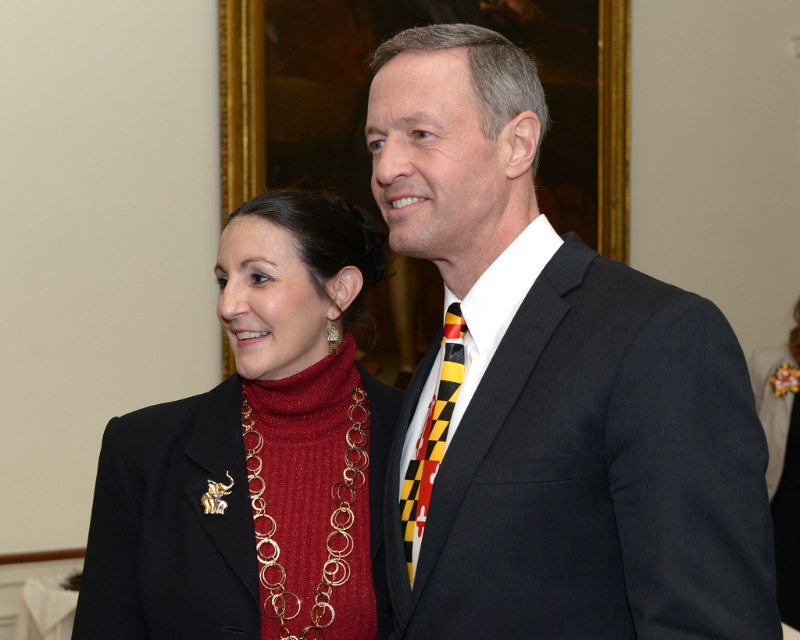
Who is lower down, black suit at center or velvet burgundy dress at right?

velvet burgundy dress at right is lower down.

Is black suit at center behind velvet burgundy dress at right?

No.

Between point (729, 481) and point (774, 355), which one is positioned behind?

The point (774, 355) is behind.

In order to click on black suit at center in this screenshot , I will do `click(554, 392)`.

Who is higher up, shiny gold necklace at center or velvet burgundy dress at right?

shiny gold necklace at center

Can you confirm if shiny gold necklace at center is positioned below velvet burgundy dress at right?

No.

Identify the location of shiny gold necklace at center. The image size is (800, 640). (245, 449).

Where is `shiny gold necklace at center`? shiny gold necklace at center is located at coordinates (245, 449).

This screenshot has height=640, width=800. Describe the element at coordinates (245, 449) in the screenshot. I see `shiny gold necklace at center` at that location.

Locate an element on the screen. Image resolution: width=800 pixels, height=640 pixels. shiny gold necklace at center is located at coordinates (245, 449).

Locate an element on the screen. shiny gold necklace at center is located at coordinates (245, 449).